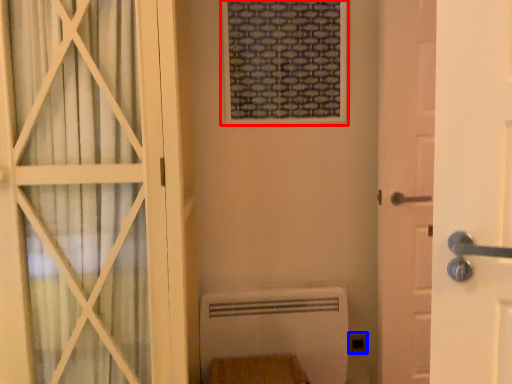
Question: Which object appears farthest to the camera in this image, window frame (highlighted by a red box) or electric outlet (highlighted by a blue box)?

Choices:
 (A) window frame
 (B) electric outlet

Answer: (B)